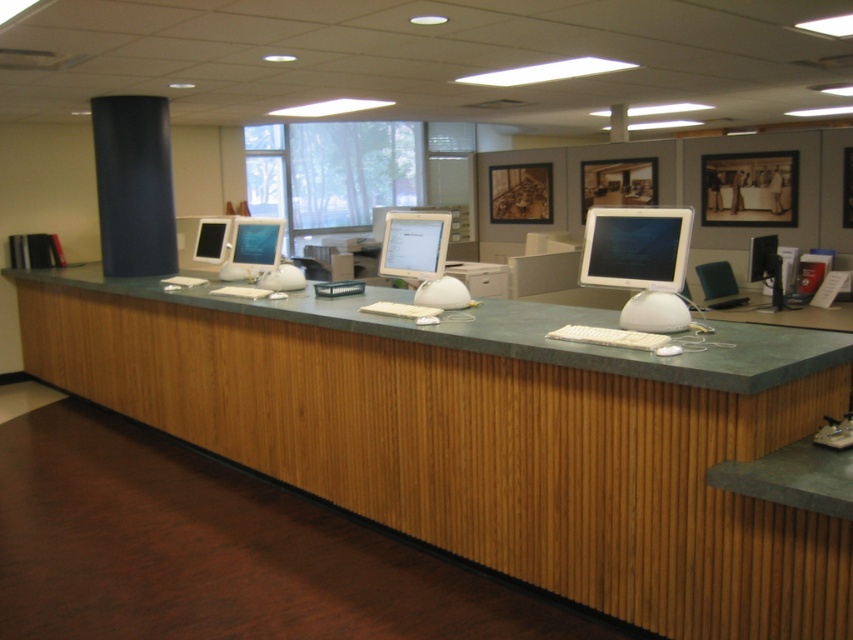
Question: Is white glossy monitor at center above matte black monitor at right?

Choices:
 (A) yes
 (B) no

Answer: (B)

Question: Among these points, which one is farthest from the camera?

Choices:
 (A) (248, 253)
 (B) (402, 262)
 (C) (637, 369)
 (D) (207, 236)

Answer: (D)

Question: Which point is farther to the camera?

Choices:
 (A) matte black monitor at right
 (B) matte black monitor at center

Answer: (A)

Question: Can you confirm if wooden at center is thinner than matte silver monitor at center?

Choices:
 (A) no
 (B) yes

Answer: (A)

Question: Is white glossy monitor at center wider than matte black monitor at right?

Choices:
 (A) no
 (B) yes

Answer: (B)

Question: Which point is closer to the camera?

Choices:
 (A) matte black monitor at center
 (B) matte silver monitor at center
 (C) white glossy monitor at center
 (D) matte plastic monitor at center

Answer: (C)